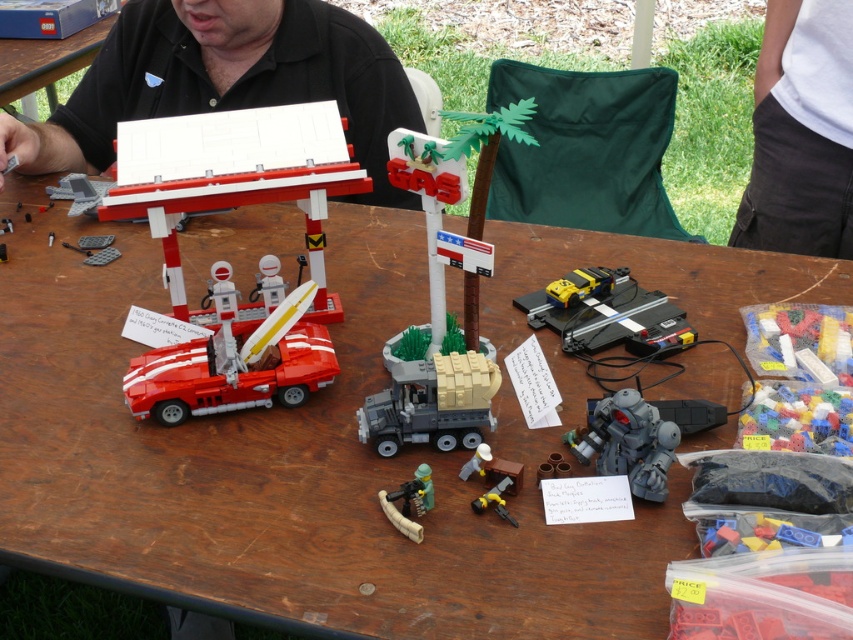
Who is more forward, [749,253] or [665,326]?

Positioned in front is point [665,326].

Is matte red car at left to the right of yellow plastic car at center from the viewer's perspective?

Incorrect, matte red car at left is not on the right side of yellow plastic car at center.

Which is behind, point (207, 228) or point (590, 352)?

Point (207, 228)

Image resolution: width=853 pixels, height=640 pixels. In order to click on matte red car at left in this screenshot , I will do `click(287, 467)`.

Which of these two, translucent plastic bag at lower right or gray metallic robot at lower center, stands shorter?

gray metallic robot at lower center

Where is `translucent plastic bag at lower right`? Image resolution: width=853 pixels, height=640 pixels. translucent plastic bag at lower right is located at coordinates (799, 378).

Identify the location of yellow plastic car at center. Image resolution: width=853 pixels, height=640 pixels. (607, 314).

Between yellow plastic car at center and metallic silver gun at center, which one is positioned lower?

Positioned lower is metallic silver gun at center.

At what (x,y) coordinates should I click in order to perform the action: click on yellow plastic car at center. Please return your answer as a coordinate pair (x, y). Image resolution: width=853 pixels, height=640 pixels. Looking at the image, I should click on (607, 314).

Locate an element on the screen. The image size is (853, 640). yellow plastic car at center is located at coordinates click(607, 314).